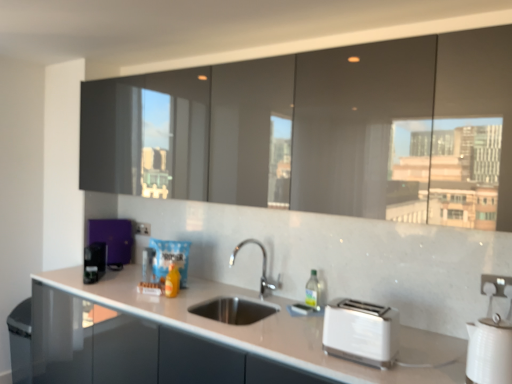
Question: Is white glossy electric kettle at lower right, which ranks as the 1th appliance in front-to-back order, in front of or behind translucent plastic bag at center in the image?

Choices:
 (A) front
 (B) behind

Answer: (A)

Question: In terms of height, does white glossy electric kettle at lower right, which ranks as the 1th appliance in front-to-back order, look taller or shorter compared to translucent plastic bag at center?

Choices:
 (A) tall
 (B) short

Answer: (A)

Question: Which is nearer to the white plastic toaster at lower right?

Choices:
 (A) purple matte coffee maker at left, the 1th appliance from the left
 (B) black plastic coffee machine at left, arranged as the 3th appliance when viewed from the back
 (C) white plastic electric outlet at center, acting as the 1th electric outlet starting from the left
 (D) white plastic electric outlet at lower right, which is the 1th electric outlet in front-to-back order
 (E) metallic silver toaster at center, placed as the 3th appliance when sorted from left to right

Answer: (D)

Question: Which object is positioned closest to the white plastic electric outlet at center, acting as the 1th electric outlet starting from the left?

Choices:
 (A) translucent plastic bag at center
 (B) purple matte coffee maker at left, which is the fourth appliance in right-to-left order
 (C) white plastic toaster at lower right
 (D) white plastic electric outlet at lower right, the 2th electric outlet in the back-to-front sequence
 (E) metallic silver toaster at center, placed as the 3th appliance when sorted from left to right

Answer: (B)